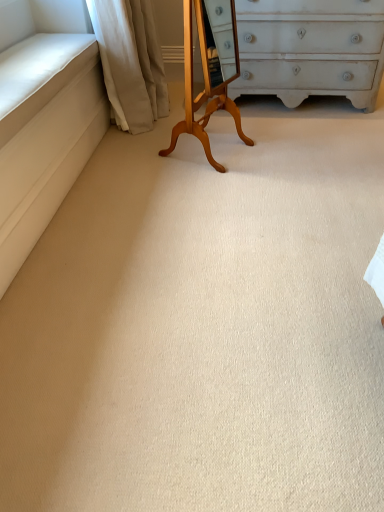
Question: In terms of size, does beige fabric curtain at upper left appear bigger or smaller than light brown wood changing table at center?

Choices:
 (A) big
 (B) small

Answer: (A)

Question: Is beige fabric curtain at upper left inside the boundaries of light brown wood changing table at center, or outside?

Choices:
 (A) outside
 (B) inside

Answer: (A)

Question: Is beige fabric curtain at upper left taller or shorter than light brown wood changing table at center?

Choices:
 (A) tall
 (B) short

Answer: (B)

Question: Is point (201, 14) positioned closer to the camera than point (89, 7)?

Choices:
 (A) closer
 (B) farther

Answer: (A)

Question: Is light brown wood changing table at center wider or thinner than beige fabric curtain at upper left?

Choices:
 (A) thin
 (B) wide

Answer: (A)

Question: Is light brown wood changing table at center in front of or behind beige fabric curtain at upper left in the image?

Choices:
 (A) behind
 (B) front

Answer: (B)

Question: From a real-world perspective, relative to beige fabric curtain at upper left, is light brown wood changing table at center vertically above or below?

Choices:
 (A) above
 (B) below

Answer: (A)